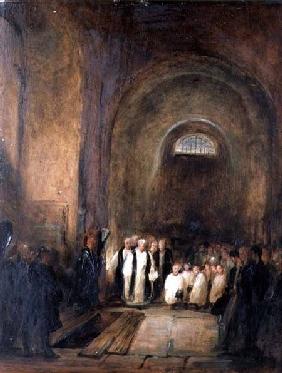
Find the location of a particular element. This screenshot has height=373, width=282. stone floor is located at coordinates (194, 332).